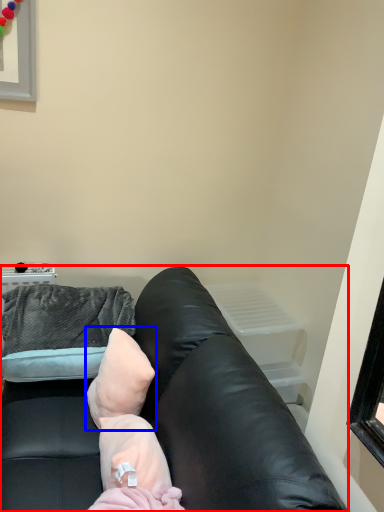
Question: Which of the following is the closest to the observer, studio couch (highlighted by a red box) or pillow (highlighted by a blue box)?

Choices:
 (A) studio couch
 (B) pillow

Answer: (A)